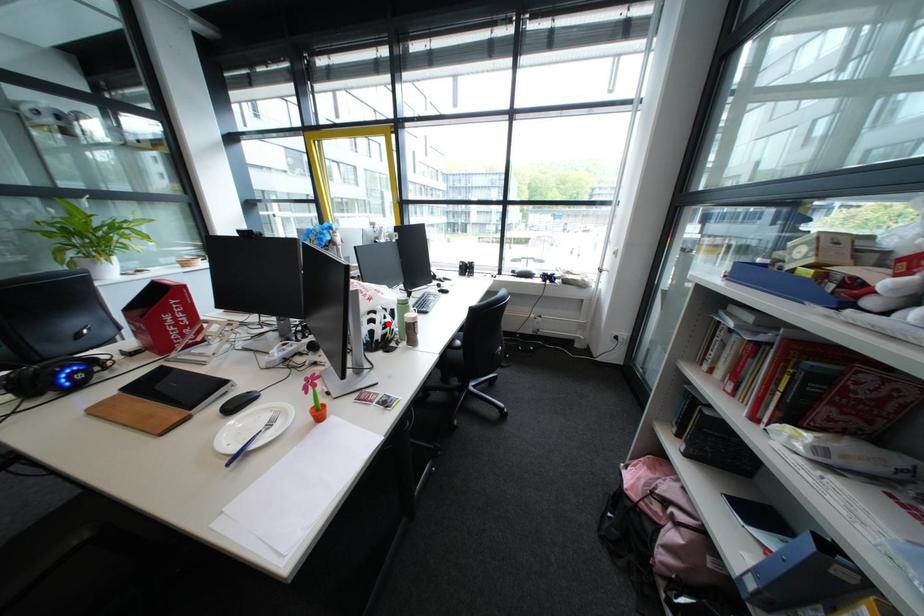
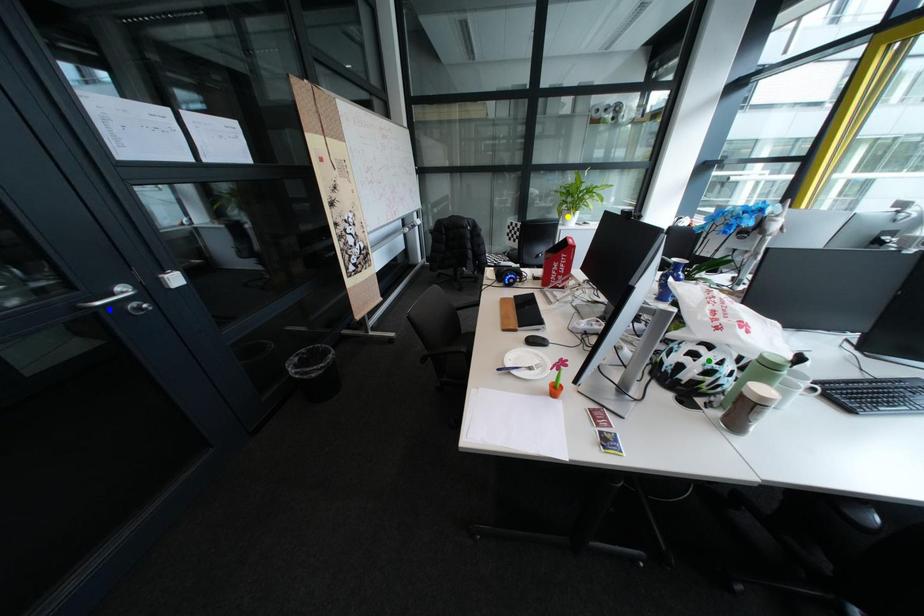
Question: I am providing you with two images of the same scene from different viewpoints. A red point is marked on the first image. You are given multiple points on the second image. Which point in image 2 is actually the same real-world point as the red point in image 1?

Choices:
 (A) yellow point
 (B) blue point
 (C) green point

Answer: (C)